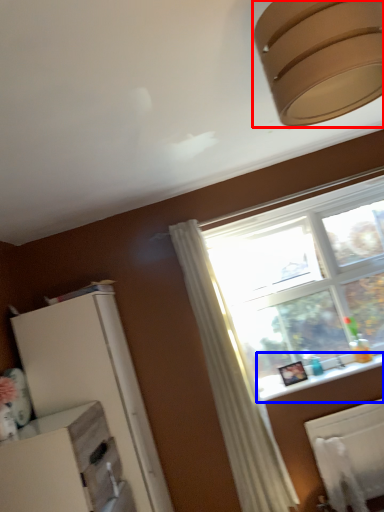
Question: Which object is further to the camera taking this photo, lamp (highlighted by a red box) or window sill (highlighted by a blue box)?

Choices:
 (A) lamp
 (B) window sill

Answer: (B)